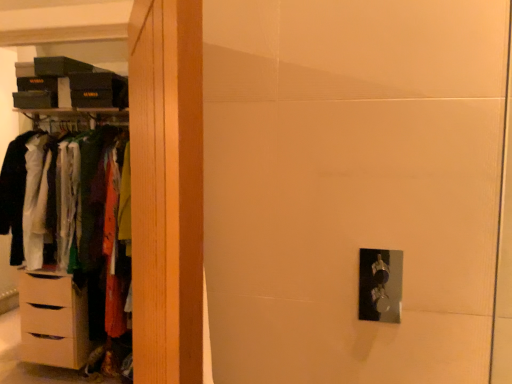
Question: From the image's perspective, is wooden wardrobe at left on top of matte wood dresser at left?

Choices:
 (A) yes
 (B) no

Answer: (B)

Question: Does wooden wardrobe at left have a greater width compared to matte wood dresser at left?

Choices:
 (A) no
 (B) yes

Answer: (A)

Question: From a real-world perspective, is wooden wardrobe at left physically below matte wood dresser at left?

Choices:
 (A) no
 (B) yes

Answer: (A)

Question: Can you confirm if wooden wardrobe at left is thinner than matte wood dresser at left?

Choices:
 (A) yes
 (B) no

Answer: (A)

Question: Does wooden wardrobe at left turn towards matte wood dresser at left?

Choices:
 (A) no
 (B) yes

Answer: (A)

Question: Can you confirm if wooden wardrobe at left is positioned to the right of matte wood dresser at left?

Choices:
 (A) no
 (B) yes

Answer: (B)

Question: Are wooden wardrobe at left and beige matte chest of drawers at left located far from each other?

Choices:
 (A) no
 (B) yes

Answer: (B)

Question: Considering the relative sizes of wooden wardrobe at left and beige matte chest of drawers at left in the image provided, is wooden wardrobe at left bigger than beige matte chest of drawers at left?

Choices:
 (A) no
 (B) yes

Answer: (A)

Question: From a real-world perspective, is wooden wardrobe at left physically above beige matte chest of drawers at left?

Choices:
 (A) yes
 (B) no

Answer: (A)

Question: Is wooden wardrobe at left at the right side of beige matte chest of drawers at left?

Choices:
 (A) yes
 (B) no

Answer: (A)

Question: Does wooden wardrobe at left have a smaller size compared to beige matte chest of drawers at left?

Choices:
 (A) no
 (B) yes

Answer: (B)

Question: Considering the relative sizes of wooden wardrobe at left and beige matte chest of drawers at left in the image provided, is wooden wardrobe at left taller than beige matte chest of drawers at left?

Choices:
 (A) yes
 (B) no

Answer: (A)

Question: Is beige matte chest of drawers at left to the right of wooden wardrobe at left from the viewer's perspective?

Choices:
 (A) no
 (B) yes

Answer: (A)